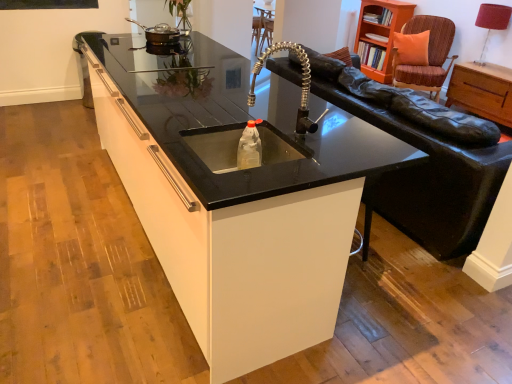
Locate an element on the screen. brown woven swivel chair at upper right is located at coordinates (428, 55).

At what (x,y) coordinates should I click in order to perform the action: click on satin nickel faucet at center. Please return your answer as a coordinate pair (x, y). Looking at the image, I should click on (302, 84).

From a real-world perspective, does satin nickel faucet at center sit lower than red fabric lampshade at upper right?

No, from a real-world perspective, satin nickel faucet at center is not below red fabric lampshade at upper right.

From the image's perspective, between satin nickel faucet at center and red fabric lampshade at upper right, who is located below?

satin nickel faucet at center appears lower in the image.

Is satin nickel faucet at center taller or shorter than red fabric lampshade at upper right?

Considering their sizes, satin nickel faucet at center has less height than red fabric lampshade at upper right.

Find the location of a particular element. This screenshot has width=512, height=384. lamp directly beneath the satin nickel faucet at center (from a real-world perspective) is located at coordinates point(492,22).

Does point (376, 12) come behind point (409, 76)?

No, it is in front of (409, 76).

Identify the location of cabinetry located behind the brown woven swivel chair at upper right. The height and width of the screenshot is (384, 512). pyautogui.click(x=380, y=34).

Is orange wood bookshelf at upper right to the left of brown woven swivel chair at upper right from the viewer's perspective?

Yes.

From the image's perspective, which is below, orange wood bookshelf at upper right or metallic silver pan at upper left?

metallic silver pan at upper left.

Is orange wood bookshelf at upper right positioned with its back to metallic silver pan at upper left?

That's not correct — orange wood bookshelf at upper right is not looking away from metallic silver pan at upper left.

Between orange wood bookshelf at upper right and metallic silver pan at upper left, which one has larger size?

Bigger between the two is orange wood bookshelf at upper right.

Consider the image. Does red fabric lampshade at upper right have a lesser width compared to satin nickel faucet at center?

Yes.

Is satin nickel faucet at center surrounded by red fabric lampshade at upper right?

No, satin nickel faucet at center is located outside of red fabric lampshade at upper right.

From a real-world perspective, relative to satin nickel faucet at center, is red fabric lampshade at upper right vertically above or below?

red fabric lampshade at upper right is below satin nickel faucet at center.

Based on the photo, which object is closer to the camera, red fabric lampshade at upper right or translucent plastic bottle at center?

translucent plastic bottle at center is more forward.

Is red fabric lampshade at upper right oriented towards translucent plastic bottle at center?

No, red fabric lampshade at upper right is not facing towards translucent plastic bottle at center.

Is red fabric lampshade at upper right not within translucent plastic bottle at center?

Absolutely, red fabric lampshade at upper right is external to translucent plastic bottle at center.

From a real-world perspective, who is located higher, red fabric lampshade at upper right or translucent plastic bottle at center?

In real-world perspective, red fabric lampshade at upper right is above.

Looking at the image, does satin nickel faucet at center seem bigger or smaller compared to translucent plastic bottle at center?

Clearly, satin nickel faucet at center is larger in size than translucent plastic bottle at center.

Is satin nickel faucet at center oriented away from translucent plastic bottle at center?

That's not correct — satin nickel faucet at center is not looking away from translucent plastic bottle at center.

From the image's perspective, is satin nickel faucet at center over translucent plastic bottle at center?

Yes, from the image's perspective, satin nickel faucet at center is on top of translucent plastic bottle at center.

Which is behind, point (159, 42) or point (313, 295)?

The point (159, 42) is more distant.

Is metallic silver pan at upper left not inside black granite sink at center?

Yes.

From the image's perspective, is metallic silver pan at upper left positioned above or below black granite sink at center?

Based on their image positions, metallic silver pan at upper left is located above black granite sink at center.

The width and height of the screenshot is (512, 384). I want to click on lamp above the satin nickel faucet at center (from the image's perspective), so click(492, 22).

You are a GUI agent. You are given a task and a screenshot of the screen. Output one action in this format:
    pyautogui.click(x=<x>, y=<y>)
    Task: Click on the swivel chair positioned vertically above the orange wood bookshelf at upper right (from a real-world perspective)
    This screenshot has width=512, height=384.
    Given the screenshot: What is the action you would take?
    pyautogui.click(x=428, y=55)

Which object lies nearer to the anchor point satin nickel faucet at center, red fabric lampshade at upper right or brown woven swivel chair at upper right?

The object closer to satin nickel faucet at center is brown woven swivel chair at upper right.

Considering their positions, is black granite sink at center positioned closer to brown woven swivel chair at upper right than translucent plastic bottle at center?

The object closer to brown woven swivel chair at upper right is black granite sink at center.

In the scene shown: Looking at the image, which one is located further to brown woven swivel chair at upper right, black granite sink at center or metallic silver pan at upper left?

black granite sink at center is positioned further to the anchor brown woven swivel chair at upper right.

Based on their spatial positions, is black granite sink at center or red fabric lampshade at upper right closer to brown woven swivel chair at upper right?

red fabric lampshade at upper right is positioned closer to the anchor brown woven swivel chair at upper right.

When comparing their distances from orange wood bookshelf at upper right, does translucent plastic bottle at center or satin nickel faucet at center seem further?

translucent plastic bottle at center is positioned further to the anchor orange wood bookshelf at upper right.

From the picture: Considering their positions, is red fabric lampshade at upper right positioned further to orange wood bookshelf at upper right than brown woven swivel chair at upper right?

red fabric lampshade at upper right is further to orange wood bookshelf at upper right.

Looking at this image, which object lies nearer to the anchor point translucent plastic bottle at center, brown woven swivel chair at upper right or red fabric lampshade at upper right?

brown woven swivel chair at upper right.

When comparing their distances from black granite sink at center, does satin nickel faucet at center or orange wood bookshelf at upper right seem further?

Based on the image, orange wood bookshelf at upper right appears to be further to black granite sink at center.

Find the location of a particular element. lamp between translucent plastic bottle at center and brown woven swivel chair at upper right in the front-back direction is located at coordinates (492, 22).

Find the location of a particular element. faucet between black granite sink at center and brown woven swivel chair at upper right along the z-axis is located at coordinates (302, 84).

The width and height of the screenshot is (512, 384). Identify the location of bottle between black granite sink at center and brown woven swivel chair at upper right from front to back. (249, 147).

Locate an element on the screen. This screenshot has width=512, height=384. lamp positioned between satin nickel faucet at center and brown woven swivel chair at upper right from near to far is located at coordinates (492, 22).